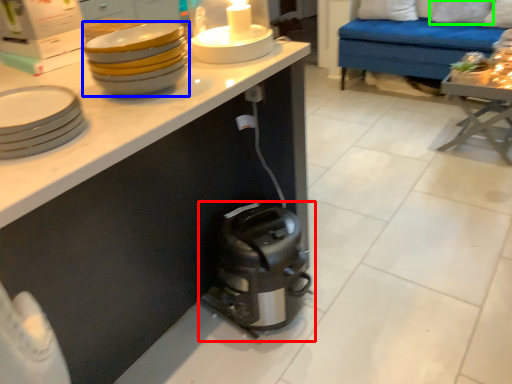
Question: Which object is positioned closest to home appliance (highlighted by a red box)? Select from tableware (highlighted by a blue box) and pillow (highlighted by a green box).

Choices:
 (A) tableware
 (B) pillow

Answer: (A)